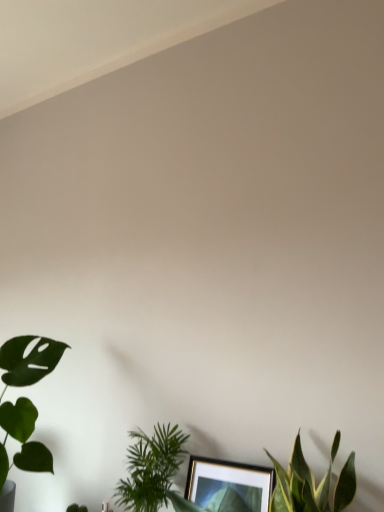
Question: From the image's perspective, does green matte leaf at lower left, which is the 3th houseplant in right-to-left order, appear higher than green leafy plant at lower center, placed as the second houseplant when sorted from left to right?

Choices:
 (A) yes
 (B) no

Answer: (A)

Question: Can you confirm if green matte leaf at lower left, placed as the first houseplant when sorted from left to right, is taller than green leafy plant at lower center, placed as the second houseplant when sorted from left to right?

Choices:
 (A) no
 (B) yes

Answer: (B)

Question: From the image's perspective, is green matte leaf at lower left, which is the 3th houseplant in right-to-left order, below green leafy plant at lower center, placed as the second houseplant when sorted from left to right?

Choices:
 (A) yes
 (B) no

Answer: (B)

Question: Is green matte leaf at lower left, placed as the first houseplant when sorted from left to right, to the left of green leafy plant at lower center, arranged as the second houseplant when viewed from the right, from the viewer's perspective?

Choices:
 (A) yes
 (B) no

Answer: (A)

Question: Are green matte leaf at lower left, placed as the first houseplant when sorted from left to right, and green leafy plant at lower center, placed as the second houseplant when sorted from left to right, beside each other?

Choices:
 (A) no
 (B) yes

Answer: (A)

Question: Choose the correct answer: Is green leafy plant at lower center, positioned as the first houseplant in right-to-left order, inside green leafy plant at lower left or outside it?

Choices:
 (A) outside
 (B) inside

Answer: (A)

Question: From a real-world perspective, is green leafy plant at lower center, which is the 3th houseplant in left-to-right order, physically located above or below green leafy plant at lower left?

Choices:
 (A) below
 (B) above

Answer: (B)

Question: Does point (299, 441) appear closer or farther from the camera than point (74, 507)?

Choices:
 (A) closer
 (B) farther

Answer: (A)

Question: From their relative heights in the image, would you say green leafy plant at lower center, positioned as the first houseplant in right-to-left order, is taller or shorter than green leafy plant at lower left?

Choices:
 (A) short
 (B) tall

Answer: (B)

Question: Visually, is green leafy plant at lower center, placed as the second houseplant when sorted from left to right, positioned to the left or to the right of green matte leaf at lower left, which is the 3th houseplant in right-to-left order?

Choices:
 (A) left
 (B) right

Answer: (B)

Question: Which is correct: green leafy plant at lower center, placed as the second houseplant when sorted from left to right, is inside green matte leaf at lower left, placed as the first houseplant when sorted from left to right, or outside of it?

Choices:
 (A) inside
 (B) outside

Answer: (B)

Question: Is point (165, 457) positioned closer to the camera than point (23, 449)?

Choices:
 (A) closer
 (B) farther

Answer: (A)

Question: Looking at their shapes, would you say green leafy plant at lower center, placed as the second houseplant when sorted from left to right, is wider or thinner than green matte leaf at lower left, placed as the first houseplant when sorted from left to right?

Choices:
 (A) thin
 (B) wide

Answer: (A)

Question: From the image's perspective, is green leafy plant at lower center, arranged as the second houseplant when viewed from the right, located above or below green leafy plant at lower left?

Choices:
 (A) above
 (B) below

Answer: (A)

Question: Would you say green leafy plant at lower center, placed as the second houseplant when sorted from left to right, is to the left or to the right of green leafy plant at lower left in the picture?

Choices:
 (A) right
 (B) left

Answer: (A)